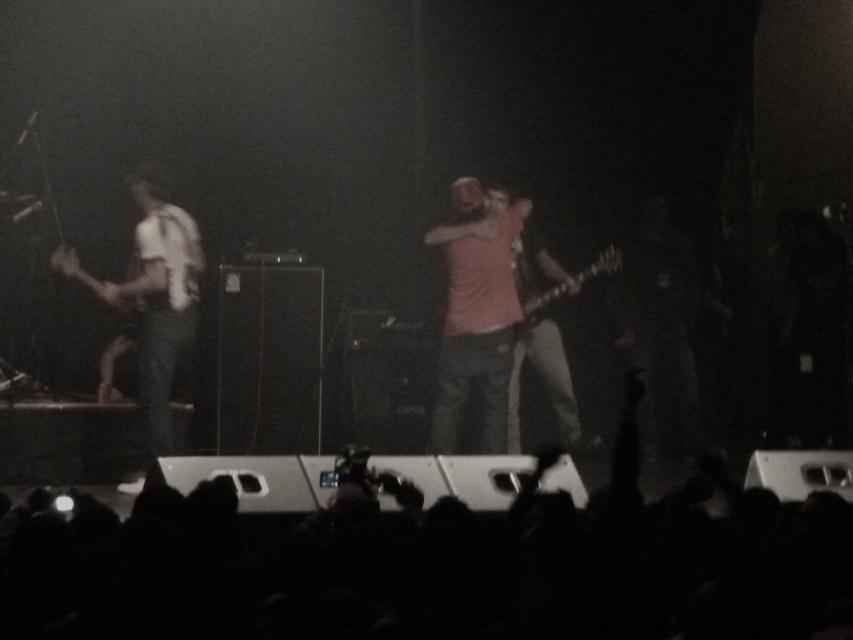
Which is in front, point (83, 285) or point (614, 268)?

Point (83, 285) is more forward.

The width and height of the screenshot is (853, 640). Describe the element at coordinates (151, 298) in the screenshot. I see `white matte shirt at left` at that location.

The width and height of the screenshot is (853, 640). Describe the element at coordinates (151, 298) in the screenshot. I see `white matte shirt at left` at that location.

Locate an element on the screen. This screenshot has width=853, height=640. white matte shirt at left is located at coordinates (151, 298).